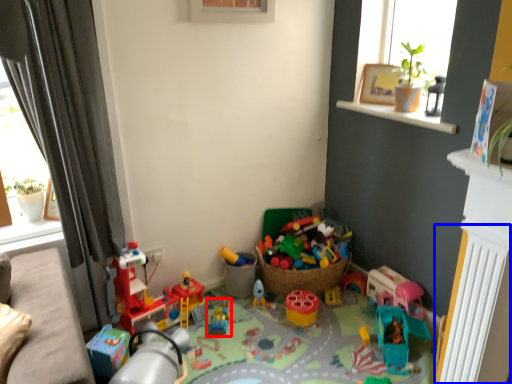
Question: Which object appears farthest to the camera in this image, toy (highlighted by a red box) or radiator (highlighted by a blue box)?

Choices:
 (A) toy
 (B) radiator

Answer: (A)